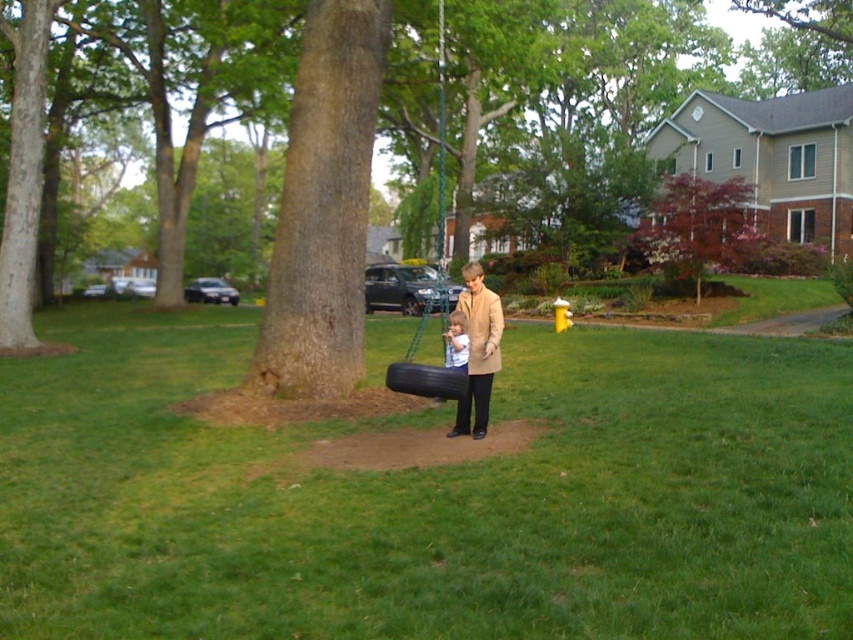
Is black rubber tire swing at center wider than beige wool coat at center?

Yes.

Does black rubber tire swing at center have a lesser height compared to beige wool coat at center?

Yes, black rubber tire swing at center is shorter than beige wool coat at center.

Image resolution: width=853 pixels, height=640 pixels. In order to click on black rubber tire swing at center in this screenshot , I will do `click(428, 497)`.

You are a GUI agent. You are given a task and a screenshot of the screen. Output one action in this format:
    pyautogui.click(x=<x>, y=<y>)
    Task: Click on the black rubber tire swing at center
    This screenshot has height=640, width=853.
    Given the screenshot: What is the action you would take?
    pyautogui.click(x=428, y=497)

Can you confirm if brown rough tree at center is positioned to the right of black rubber tire at center?

Correct, you'll find brown rough tree at center to the right of black rubber tire at center.

Who is taller, brown rough tree at center or black rubber tire at center?

brown rough tree at center is taller.

Which is in front, point (500, 26) or point (403, 381)?

Point (403, 381) is more forward.

Locate an element on the screen. The width and height of the screenshot is (853, 640). brown rough tree at center is located at coordinates (328, 193).

Is brown rough tree at center bigger than reddish-brown bark tree at upper right?

Yes, brown rough tree at center is bigger than reddish-brown bark tree at upper right.

Consider the image. Between brown rough tree at center and reddish-brown bark tree at upper right, which one appears on the left side from the viewer's perspective?

From the viewer's perspective, brown rough tree at center appears more on the left side.

This screenshot has width=853, height=640. Find the location of `brown rough tree at center`. brown rough tree at center is located at coordinates click(x=328, y=193).